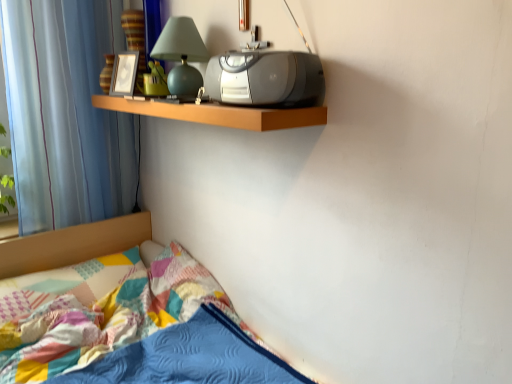
Locate an element on the screen. Image resolution: width=512 pixels, height=384 pixels. satin silver stereo at upper center is located at coordinates (266, 79).

Describe the element at coordinates (218, 113) in the screenshot. I see `wooden shelf at upper center` at that location.

Measure the distance between point (94, 12) and camera.

Point (94, 12) and camera are 6.31 feet apart.

What do you see at coordinates (155, 80) in the screenshot?
I see `green rubber duck at upper center` at bounding box center [155, 80].

The height and width of the screenshot is (384, 512). Describe the element at coordinates (140, 335) in the screenshot. I see `textured cotton quilt at lower left` at that location.

Image resolution: width=512 pixels, height=384 pixels. In order to click on satin silver stereo at upper center in this screenshot , I will do tap(266, 79).

From a real-world perspective, which object rests below the other?

textured cotton quilt at lower left.

Between blue sheer curtain at left and textured cotton quilt at lower left, which one has smaller size?

blue sheer curtain at left.

From the image's perspective, which is above, blue sheer curtain at left or textured cotton quilt at lower left?

From the image's view, blue sheer curtain at left is above.

Considering the relative positions of blue sheer curtain at left and wooden shelf at upper center in the image provided, is blue sheer curtain at left to the left or to the right of wooden shelf at upper center?

blue sheer curtain at left is to the left of wooden shelf at upper center.

Who is smaller, blue sheer curtain at left or wooden shelf at upper center?

With smaller size is wooden shelf at upper center.

From a real-world perspective, does blue sheer curtain at left stand above wooden shelf at upper center?

No, from a real-world perspective, blue sheer curtain at left is not on top of wooden shelf at upper center.

How different are the orientations of blue sheer curtain at left and wooden shelf at upper center in degrees?

blue sheer curtain at left and wooden shelf at upper center are facing 89.9 degrees away from each other.

Is satin silver stereo at upper center wider than green rubber duck at upper center?

Indeed, satin silver stereo at upper center has a greater width compared to green rubber duck at upper center.

Does satin silver stereo at upper center have a greater height compared to green rubber duck at upper center?

No, satin silver stereo at upper center is not taller than green rubber duck at upper center.

Who is smaller, satin silver stereo at upper center or green rubber duck at upper center?

green rubber duck at upper center.

Is blue sheer curtain at left next to satin silver stereo at upper center?

They are not placed beside each other.

Is blue sheer curtain at left positioned with its back to satin silver stereo at upper center?

That's not correct — blue sheer curtain at left is not looking away from satin silver stereo at upper center.

Between blue sheer curtain at left and satin silver stereo at upper center, which one has more height?

blue sheer curtain at left is taller.

Which of these two, blue sheer curtain at left or satin silver stereo at upper center, is wider?

satin silver stereo at upper center is wider.

From a real-world perspective, relative to satin silver stereo at upper center, is matte green glass table lamp at upper center vertically above or below?

matte green glass table lamp at upper center is situated higher than satin silver stereo at upper center in the real world.

From the image's perspective, would you say matte green glass table lamp at upper center is positioned over satin silver stereo at upper center?

Yes, from the image's perspective, matte green glass table lamp at upper center is above satin silver stereo at upper center.

Considering the sizes of objects matte green glass table lamp at upper center and satin silver stereo at upper center in the image provided, who is wider, matte green glass table lamp at upper center or satin silver stereo at upper center?

Result: matte green glass table lamp at upper center is wider.

Consider the image. Which is in front, matte green glass table lamp at upper center or satin silver stereo at upper center?

satin silver stereo at upper center is more forward.

In terms of height, does green rubber duck at upper center look taller or shorter compared to matte green glass table lamp at upper center?

green rubber duck at upper center is shorter than matte green glass table lamp at upper center.

From the image's perspective, between green rubber duck at upper center and matte green glass table lamp at upper center, who is located below?

From the image's view, green rubber duck at upper center is below.

Is green rubber duck at upper center turned away from matte green glass table lamp at upper center?

No, green rubber duck at upper center is not facing the opposite direction of matte green glass table lamp at upper center.

Between green rubber duck at upper center and matte green glass table lamp at upper center, which one has larger width?

Wider between the two is matte green glass table lamp at upper center.

Is wooden shelf at upper center to the right of blue sheer curtain at left from the viewer's perspective?

Indeed, wooden shelf at upper center is positioned on the right side of blue sheer curtain at left.

In terms of size, does wooden shelf at upper center appear bigger or smaller than blue sheer curtain at left?

Clearly, wooden shelf at upper center is smaller in size than blue sheer curtain at left.

From a real-world perspective, relative to blue sheer curtain at left, is wooden shelf at upper center vertically above or below?

wooden shelf at upper center is situated higher than blue sheer curtain at left in the real world.

Is point (185, 117) positioned before point (67, 90)?

Yes.

Where is `bed lying on the right of blue sheer curtain at left`? The width and height of the screenshot is (512, 384). bed lying on the right of blue sheer curtain at left is located at coordinates (140, 335).

Locate an element on the screen. curtain behind the wooden shelf at upper center is located at coordinates (65, 113).

Based on their spatial positions, is wooden shelf at upper center or textured cotton quilt at lower left closer to green rubber duck at upper center?

wooden shelf at upper center.

Based on their spatial positions, is satin silver stereo at upper center or green rubber duck at upper center further from blue sheer curtain at left?

satin silver stereo at upper center is further to blue sheer curtain at left.

From the image, which object appears to be nearer to green rubber duck at upper center, textured cotton quilt at lower left or matte green glass table lamp at upper center?

matte green glass table lamp at upper center is positioned closer to the anchor green rubber duck at upper center.

From the picture: When comparing their distances from satin silver stereo at upper center, does blue sheer curtain at left or green rubber duck at upper center seem further?

Based on the image, blue sheer curtain at left appears to be further to satin silver stereo at upper center.

From the image, which object appears to be nearer to green rubber duck at upper center, matte green glass table lamp at upper center or textured cotton quilt at lower left?

matte green glass table lamp at upper center is closer to green rubber duck at upper center.

Considering their positions, is blue sheer curtain at left positioned further to matte green glass table lamp at upper center than green rubber duck at upper center?

blue sheer curtain at left is positioned further to the anchor matte green glass table lamp at upper center.

Which object lies further to the anchor point green rubber duck at upper center, blue sheer curtain at left or satin silver stereo at upper center?

satin silver stereo at upper center.

Looking at the image, which one is located closer to blue sheer curtain at left, green rubber duck at upper center or wooden shelf at upper center?

Among the two, wooden shelf at upper center is located nearer to blue sheer curtain at left.

You are a GUI agent. You are given a task and a screenshot of the screen. Output one action in this format:
    pyautogui.click(x=<x>, y=<y>)
    Task: Click on the shelf that lies between matte green glass table lamp at upper center and textured cotton quilt at lower left from top to bottom
    The height and width of the screenshot is (384, 512).
    Given the screenshot: What is the action you would take?
    pyautogui.click(x=218, y=113)

You are a GUI agent. You are given a task and a screenshot of the screen. Output one action in this format:
    pyautogui.click(x=<x>, y=<y>)
    Task: Click on the stereo that lies between matte green glass table lamp at upper center and textured cotton quilt at lower left from top to bottom
    This screenshot has width=512, height=384.
    Given the screenshot: What is the action you would take?
    pyautogui.click(x=266, y=79)

This screenshot has height=384, width=512. I want to click on curtain between wooden shelf at upper center and green rubber duck at upper center along the z-axis, so click(65, 113).

The height and width of the screenshot is (384, 512). I want to click on toy between matte green glass table lamp at upper center and textured cotton quilt at lower left from top to bottom, so click(155, 80).